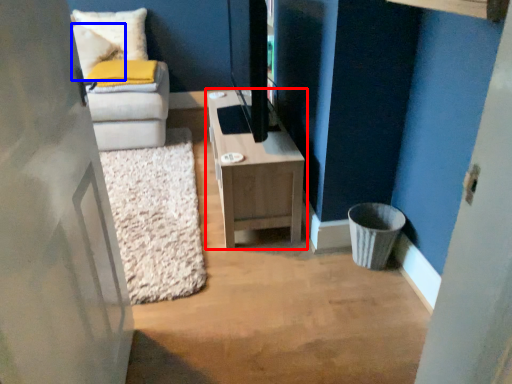
Question: Which object is closer to the camera taking this photo, table (highlighted by a red box) or pillow (highlighted by a blue box)?

Choices:
 (A) table
 (B) pillow

Answer: (A)